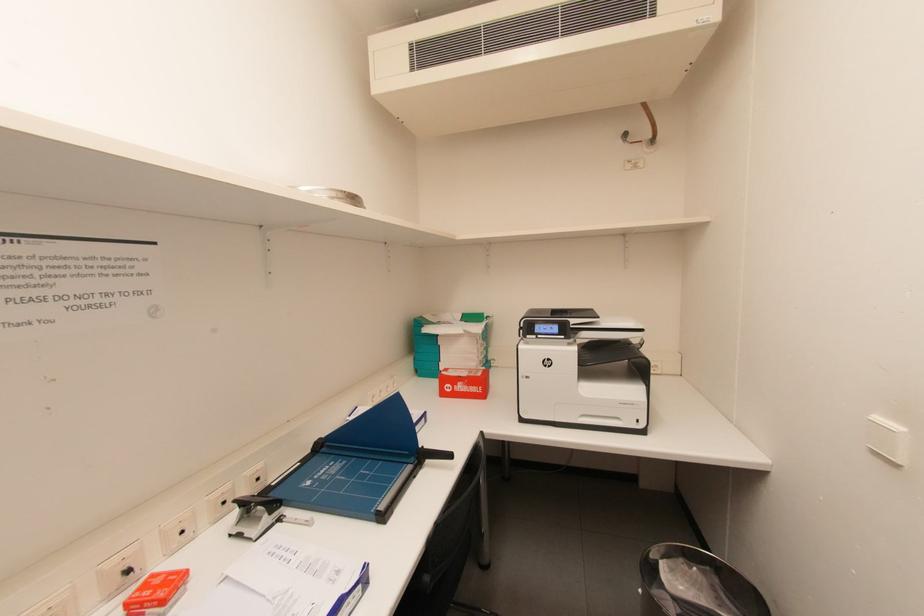
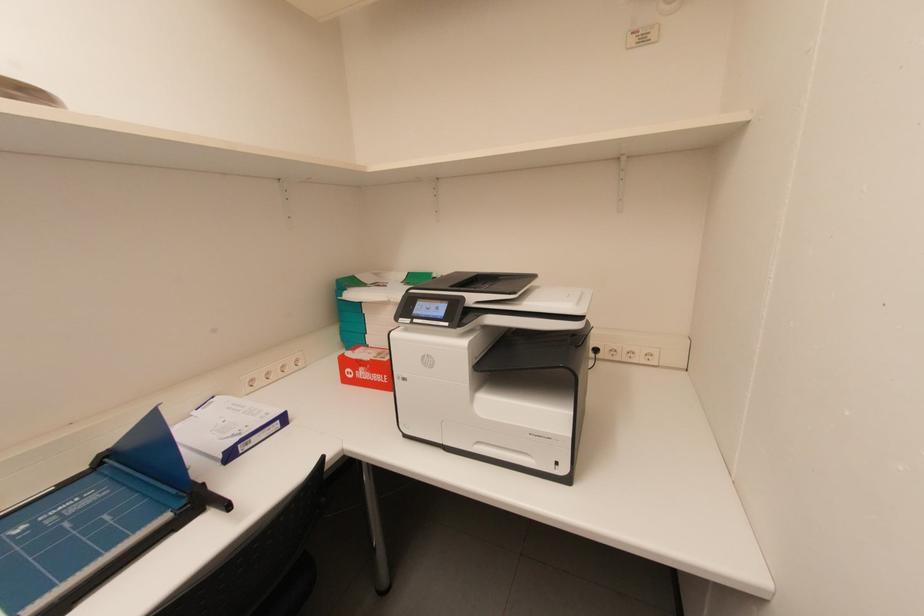
What movement of the cameraman would produce the second image?

The cameraman walked toward right, forward.